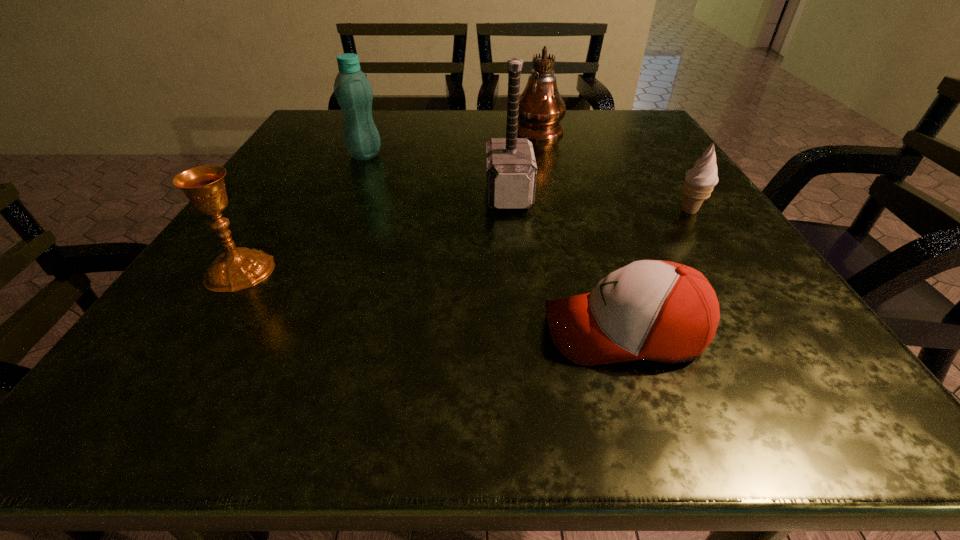
The height and width of the screenshot is (540, 960). Identify the location of unoccupied area between the nearest object and the oil lamp. (581, 230).

At what (x,y) coordinates should I click in order to perform the action: click on unoccupied area between the farthest object and the baseball cap. Please return your answer as a coordinate pair (x, y). Image resolution: width=960 pixels, height=540 pixels. Looking at the image, I should click on (581, 230).

This screenshot has width=960, height=540. I want to click on free area in between the tallest object and the chalice, so point(389,199).

Identify the location of free space between the fifth object from right to left and the oil lamp. This screenshot has height=540, width=960. (451, 141).

Find the location of `vacant area that lies between the fourth shortest object and the tallest object`. vacant area that lies between the fourth shortest object and the tallest object is located at coordinates (451, 141).

Locate an element on the screen. object that stands as the fourth closest to the hammer is located at coordinates (700, 180).

This screenshot has height=540, width=960. Find the location of `object that stands as the second closest to the fourth tallest object`. object that stands as the second closest to the fourth tallest object is located at coordinates (511, 171).